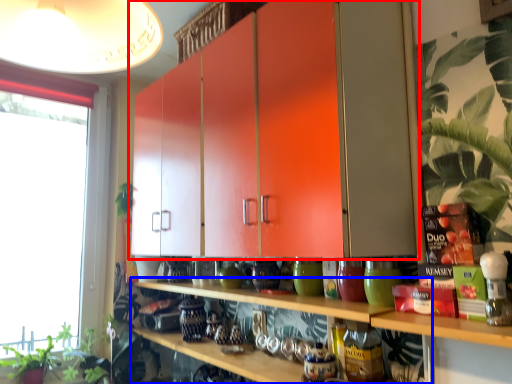
Question: Which point is further to the camera, cabinetry (highlighted by a red box) or shelf (highlighted by a blue box)?

Choices:
 (A) cabinetry
 (B) shelf

Answer: (B)